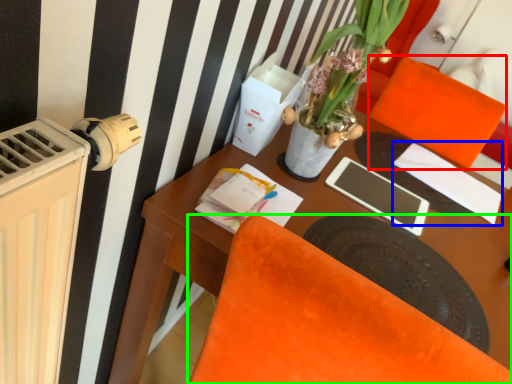
Question: Which object is positioned closest to armchair (highlighted by a red box)? Select from notepad (highlighted by a blue box) and chair (highlighted by a green box).

Choices:
 (A) notepad
 (B) chair

Answer: (A)